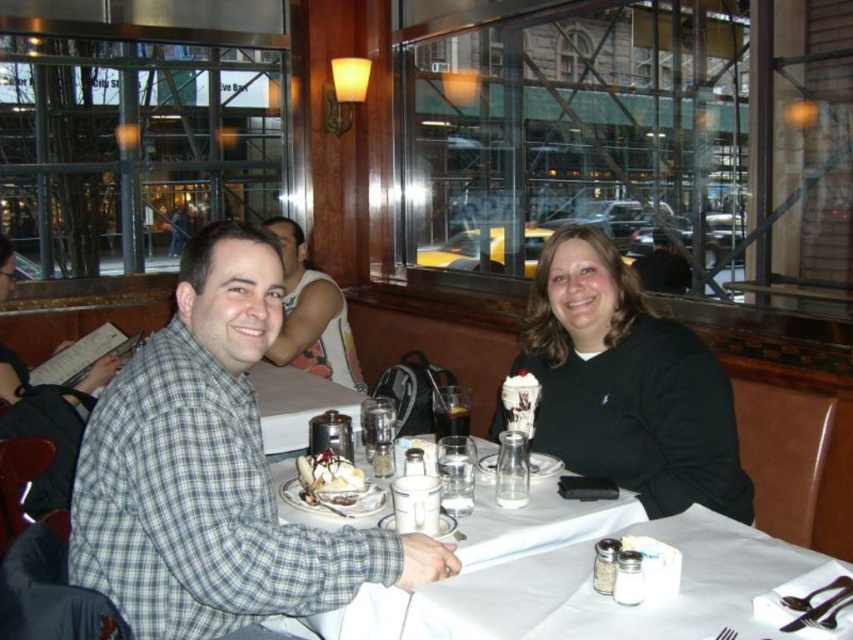
Looking at this image, you are a server who just noticed that the white paper napkin at center and the whipped cream topped sundae at center are both on the table. Which one is taller?

The white paper napkin at center is much taller than the whipped cream topped sundae at center.

You are a server in a restaurant and need to place a new dessert plate between the white paper napkin at center and the whipped cream topped sundae at center. Is there enough space between them to fit the dessert plate?

The white paper napkin at center is larger than the whipped cream topped sundae at center, so there might not be enough space between them to fit another dessert plate.